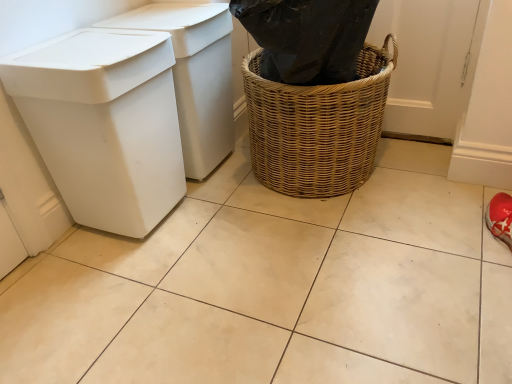
Question: Can you confirm if white plastic bin at left, acting as the second waste container starting from the front, is positioned to the left of woven brown basket at center?

Choices:
 (A) yes
 (B) no

Answer: (A)

Question: From the image's perspective, would you say white plastic bin at left, acting as the second waste container starting from the front, is shown under woven brown basket at center?

Choices:
 (A) yes
 (B) no

Answer: (B)

Question: Does white plastic bin at left, the first waste container in the back-to-front sequence, turn towards woven brown basket at center?

Choices:
 (A) no
 (B) yes

Answer: (B)

Question: From a real-world perspective, is white plastic bin at left, the first waste container in the back-to-front sequence, below woven brown basket at center?

Choices:
 (A) no
 (B) yes

Answer: (A)

Question: Is white plastic bin at left, the first waste container in the back-to-front sequence, shorter than woven brown basket at center?

Choices:
 (A) no
 (B) yes

Answer: (A)

Question: Is white plastic bin at left, acting as the second waste container starting from the front, wider or thinner than white plastic bin at left, the 1th waste container viewed from the front?

Choices:
 (A) wide
 (B) thin

Answer: (B)

Question: Is white plastic bin at left, acting as the second waste container starting from the front, inside the boundaries of white plastic bin at left, which is the 2th waste container in back-to-front order, or outside?

Choices:
 (A) inside
 (B) outside

Answer: (B)

Question: Is point (204, 127) closer or farther from the camera than point (115, 173)?

Choices:
 (A) closer
 (B) farther

Answer: (B)

Question: Is white plastic bin at left, the first waste container in the back-to-front sequence, to the left or to the right of white plastic bin at left, the 1th waste container viewed from the front, in the image?

Choices:
 (A) right
 (B) left

Answer: (A)

Question: From the image's perspective, is white plastic bin at left, which is the 2th waste container in back-to-front order, positioned above or below woven brown basket at center?

Choices:
 (A) above
 (B) below

Answer: (B)

Question: In the image, is white plastic bin at left, which is the 2th waste container in back-to-front order, positioned in front of or behind woven brown basket at center?

Choices:
 (A) behind
 (B) front

Answer: (B)

Question: From a real-world perspective, relative to woven brown basket at center, is white plastic bin at left, which is the 2th waste container in back-to-front order, vertically above or below?

Choices:
 (A) below
 (B) above

Answer: (B)

Question: Based on their sizes in the image, would you say white plastic bin at left, which is the 2th waste container in back-to-front order, is bigger or smaller than woven brown basket at center?

Choices:
 (A) small
 (B) big

Answer: (A)

Question: From a real-world perspective, is white plastic bin at left, acting as the second waste container starting from the front, positioned above or below woven brown basket at center?

Choices:
 (A) above
 (B) below

Answer: (A)

Question: Considering the positions of white plastic bin at left, acting as the second waste container starting from the front, and woven brown basket at center in the image, is white plastic bin at left, acting as the second waste container starting from the front, bigger or smaller than woven brown basket at center?

Choices:
 (A) small
 (B) big

Answer: (A)